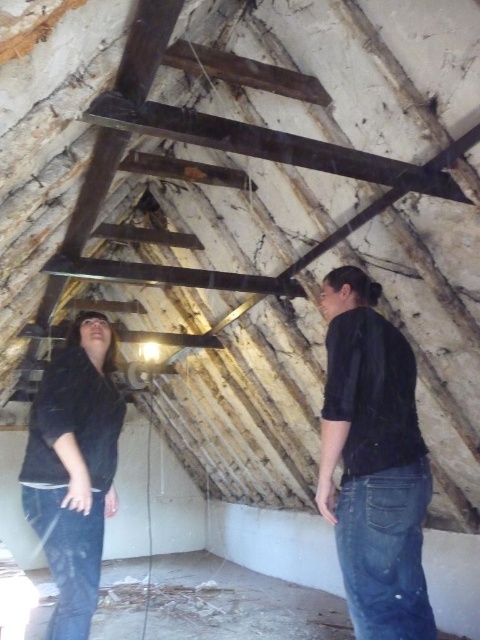
Between black matte shirt at center and black matte jacket at lower left, which one appears on the right side from the viewer's perspective?

Positioned to the right is black matte shirt at center.

Who is more forward, (415, 406) or (31, 458)?

Point (415, 406) is in front.

Find the location of a particular element. black matte shirt at center is located at coordinates (373, 461).